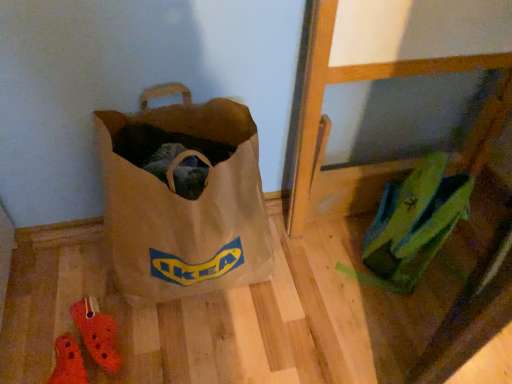
Question: Considering their positions, is rubber crocs at lower left, which ranks as the second footwear in top-to-bottom order, located in front of or behind brown canvas bag at lower left?

Choices:
 (A) front
 (B) behind

Answer: (B)

Question: From the image's perspective, is rubber crocs at lower left, which is counted as the 1th footwear, starting from the bottom, above or below brown canvas bag at lower left?

Choices:
 (A) above
 (B) below

Answer: (B)

Question: Estimate the real-world distances between objects in this image. Which object is closer to the brown canvas bag at lower left?

Choices:
 (A) rubber crocs at lower left, which ranks as the second footwear in top-to-bottom order
 (B) green fabric backpack at upper right
 (C) orange croc at lower left, the second footwear positioned from the bottom

Answer: (C)

Question: Estimate the real-world distances between objects in this image. Which object is farther from the orange croc at lower left, the second footwear positioned from the bottom?

Choices:
 (A) rubber crocs at lower left, which is counted as the 1th footwear, starting from the bottom
 (B) green fabric backpack at upper right
 (C) brown canvas bag at lower left

Answer: (B)